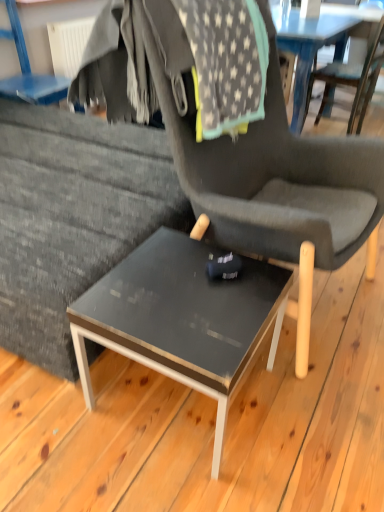
The width and height of the screenshot is (384, 512). Describe the element at coordinates (183, 318) in the screenshot. I see `matte black table at center` at that location.

Describe the element at coordinates (28, 70) in the screenshot. I see `matte gray chair at upper left, arranged as the third chair when viewed from the right` at that location.

Identify the location of matte gray chair at upper left, arranged as the third chair when viewed from the right. The width and height of the screenshot is (384, 512). (28, 70).

This screenshot has width=384, height=512. Describe the element at coordinates (351, 80) in the screenshot. I see `wooden chair at center, which is the 3th chair in left-to-right order` at that location.

This screenshot has width=384, height=512. In order to click on matte black table at center in this screenshot , I will do [x=183, y=318].

Is matte black chair at center, the 2th chair from the left, aimed at matte black table at center?

No, matte black chair at center, the 2th chair from the left, is not oriented towards matte black table at center.

Considering the relative sizes of matte black chair at center, the 2th chair from the left, and matte black table at center in the image provided, is matte black chair at center, the 2th chair from the left, bigger than matte black table at center?

Yes.

Based on the photo, is matte black chair at center, the 2th chair from the left, further to camera compared to matte black table at center?

No, matte black chair at center, the 2th chair from the left, is closer to the viewer.

Is matte black chair at center, the 2th chair in the right-to-left sequence, located outside matte black table at center?

Yes, matte black chair at center, the 2th chair in the right-to-left sequence, is outside of matte black table at center.

From a real-world perspective, is matte black table at center located beneath matte black chair at center, the 2th chair from the left?

Yes, from a real-world perspective, matte black table at center is beneath matte black chair at center, the 2th chair from the left.

Is matte black table at center in contact with matte black chair at center, the 2th chair from the left?

There is a gap between matte black table at center and matte black chair at center, the 2th chair from the left.

Is matte black table at center shorter than matte black chair at center, the 2th chair in the right-to-left sequence?

Yes.

Is point (363, 111) farther from camera compared to point (194, 179)?

Yes, point (363, 111) is behind point (194, 179).

Is wooden chair at center, which is the 3th chair in left-to-right order, beside matte black chair at center, the 2th chair in the right-to-left sequence?

No, wooden chair at center, which is the 3th chair in left-to-right order, is not next to matte black chair at center, the 2th chair in the right-to-left sequence.

Is wooden chair at center, arranged as the first chair when viewed from the right, thinner than matte black chair at center, the 2th chair from the left?

Correct, the width of wooden chair at center, arranged as the first chair when viewed from the right, is less than that of matte black chair at center, the 2th chair from the left.

Can you tell me how much matte black table at center and wooden chair at center, arranged as the first chair when viewed from the right, differ in facing direction?

79.9 degrees separate the facing orientations of matte black table at center and wooden chair at center, arranged as the first chair when viewed from the right.

From the image's perspective, who appears lower, matte black table at center or wooden chair at center, arranged as the first chair when viewed from the right?

From the image's view, matte black table at center is below.

You are a GUI agent. You are given a task and a screenshot of the screen. Output one action in this format:
    pyautogui.click(x=<x>, y=<y>)
    Task: Click on the 1st chair positioned above the matte black table at center (from a real-world perspective)
    This screenshot has width=384, height=512.
    Given the screenshot: What is the action you would take?
    pyautogui.click(x=351, y=80)

Would you say matte black table at center contains wooden chair at center, which is the 3th chair in left-to-right order?

That's incorrect, wooden chair at center, which is the 3th chair in left-to-right order, is not inside matte black table at center.

From a real-world perspective, is matte gray chair at upper left, arranged as the 1th chair when viewed from the left, over matte black chair at center, the 2th chair from the left?

Yes, from a real-world perspective, matte gray chair at upper left, arranged as the 1th chair when viewed from the left, is on top of matte black chair at center, the 2th chair from the left.

Locate an element on the screen. Image resolution: width=384 pixels, height=512 pixels. chair above the matte black chair at center, the 2th chair from the left (from a real-world perspective) is located at coordinates (28, 70).

Consider the image. Are matte gray chair at upper left, arranged as the 1th chair when viewed from the left, and matte black chair at center, the 2th chair from the left, far apart?

That's right, there is a large distance between matte gray chair at upper left, arranged as the 1th chair when viewed from the left, and matte black chair at center, the 2th chair from the left.

Between matte gray chair at upper left, arranged as the third chair when viewed from the right, and matte black chair at center, the 2th chair in the right-to-left sequence, which one is positioned behind?

Positioned behind is matte gray chair at upper left, arranged as the third chair when viewed from the right.

Is matte black table at center completely or partially inside matte gray chair at upper left, arranged as the 1th chair when viewed from the left?

No.

From the picture: Between matte gray chair at upper left, arranged as the third chair when viewed from the right, and matte black table at center, which one has more height?

With more height is matte gray chair at upper left, arranged as the third chair when viewed from the right.

Is matte gray chair at upper left, arranged as the third chair when viewed from the right, turned away from matte black table at center?

No.

Could you tell me if wooden chair at center, which is the 3th chair in left-to-right order, is facing matte gray chair at upper left, arranged as the third chair when viewed from the right?

No, wooden chair at center, which is the 3th chair in left-to-right order, does not turn towards matte gray chair at upper left, arranged as the third chair when viewed from the right.

Is wooden chair at center, arranged as the first chair when viewed from the right, touching matte gray chair at upper left, arranged as the 1th chair when viewed from the left?

No, wooden chair at center, arranged as the first chair when viewed from the right, is not with matte gray chair at upper left, arranged as the 1th chair when viewed from the left.

Who is smaller, wooden chair at center, which is the 3th chair in left-to-right order, or matte gray chair at upper left, arranged as the 1th chair when viewed from the left?

With smaller size is matte gray chair at upper left, arranged as the 1th chair when viewed from the left.

Consider the image. From the image's perspective, is wooden chair at center, which is the 3th chair in left-to-right order, located above or below matte gray chair at upper left, arranged as the third chair when viewed from the right?

Clearly, from the image's perspective, wooden chair at center, which is the 3th chair in left-to-right order, is above matte gray chair at upper left, arranged as the third chair when viewed from the right.

From the image's perspective, count 1st chairs upward from the matte black table at center and point to it. Please provide its 2D coordinates.

[(277, 186)]

From a real-world perspective, which chair is the 2nd one above the matte black table at center? Please provide its 2D coordinates.

[(277, 186)]

Considering their positions, is wooden chair at center, arranged as the first chair when viewed from the right, positioned further to matte black table at center than matte gray chair at upper left, arranged as the 1th chair when viewed from the left?

wooden chair at center, arranged as the first chair when viewed from the right, is further to matte black table at center.

Looking at the image, which one is located closer to matte gray chair at upper left, arranged as the 1th chair when viewed from the left, matte black chair at center, the 2th chair in the right-to-left sequence, or wooden chair at center, which is the 3th chair in left-to-right order?

Answer: matte black chair at center, the 2th chair in the right-to-left sequence, lies closer to matte gray chair at upper left, arranged as the 1th chair when viewed from the left, than the other object.

Looking at the image, which one is located closer to wooden chair at center, which is the 3th chair in left-to-right order, matte gray chair at upper left, arranged as the 1th chair when viewed from the left, or matte black chair at center, the 2th chair from the left?

matte black chair at center, the 2th chair from the left, is positioned closer to the anchor wooden chair at center, which is the 3th chair in left-to-right order.

When comparing their distances from matte black table at center, does matte gray chair at upper left, arranged as the third chair when viewed from the right, or wooden chair at center, which is the 3th chair in left-to-right order, seem closer?

matte gray chair at upper left, arranged as the third chair when viewed from the right, lies closer to matte black table at center than the other object.

Which object lies further to the anchor point matte black table at center, matte black chair at center, the 2th chair from the left, or wooden chair at center, which is the 3th chair in left-to-right order?

Among the two, wooden chair at center, which is the 3th chair in left-to-right order, is located further to matte black table at center.

Which object lies further to the anchor point matte gray chair at upper left, arranged as the third chair when viewed from the right, wooden chair at center, which is the 3th chair in left-to-right order, or matte black chair at center, the 2th chair in the right-to-left sequence?

Among the two, wooden chair at center, which is the 3th chair in left-to-right order, is located further to matte gray chair at upper left, arranged as the third chair when viewed from the right.

Estimate the real-world distances between objects in this image. Which object is closer to matte black table at center, wooden chair at center, arranged as the first chair when viewed from the right, or matte black chair at center, the 2th chair from the left?

The object closer to matte black table at center is matte black chair at center, the 2th chair from the left.

When comparing their distances from matte gray chair at upper left, arranged as the third chair when viewed from the right, does matte black chair at center, the 2th chair from the left, or matte black table at center seem further?

matte black table at center is further to matte gray chair at upper left, arranged as the third chair when viewed from the right.

The width and height of the screenshot is (384, 512). I want to click on coffee table located between matte black chair at center, the 2th chair in the right-to-left sequence, and wooden chair at center, arranged as the first chair when viewed from the right, in the depth direction, so click(x=183, y=318).

This screenshot has width=384, height=512. In order to click on chair between matte gray chair at upper left, arranged as the third chair when viewed from the right, and wooden chair at center, which is the 3th chair in left-to-right order, in the horizontal direction in this screenshot , I will do pyautogui.click(x=277, y=186).

The image size is (384, 512). What are the coordinates of `coffee table between matte black chair at center, the 2th chair from the left, and matte gray chair at upper left, arranged as the 1th chair when viewed from the left, in the front-back direction` in the screenshot? It's located at (183, 318).

What are the coordinates of `coffee table between matte gray chair at upper left, arranged as the 1th chair when viewed from the left, and wooden chair at center, arranged as the first chair when viewed from the right` in the screenshot? It's located at (183, 318).